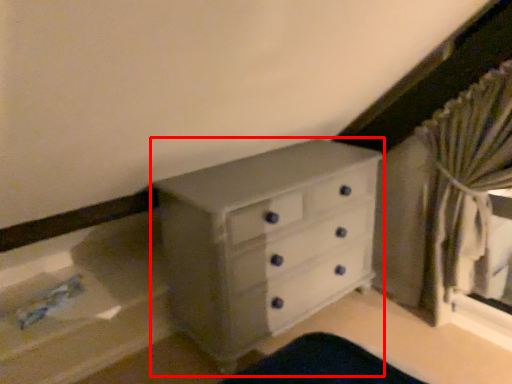
Question: From the image's perspective, where is chest of drawers (annotated by the red box) located relative to curtain?

Choices:
 (A) below
 (B) above

Answer: (A)